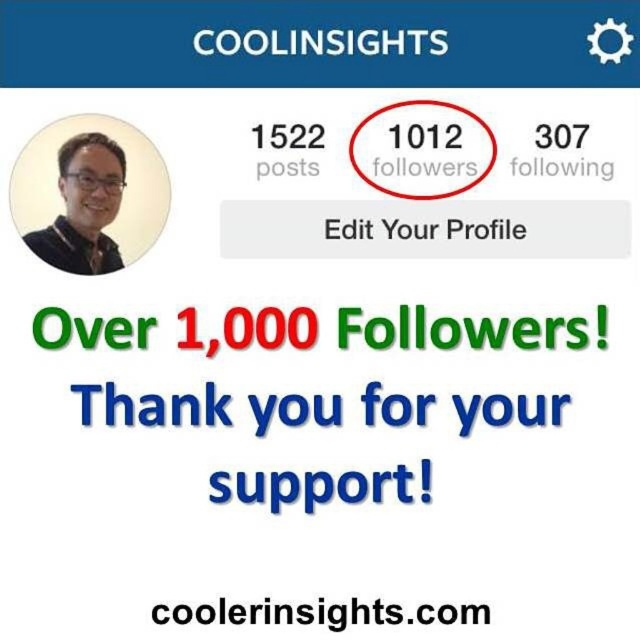
Does matte black glasses at upper left have a lesser height compared to black text at center?

Incorrect, matte black glasses at upper left's height does not fall short of black text at center's.

Is matte black glasses at upper left further to the viewer compared to black text at center?

Yes.

Is point (118, 177) farther from viewer compared to point (305, 609)?

Yes, point (118, 177) is behind point (305, 609).

Locate an element on the screen. The height and width of the screenshot is (640, 640). matte black glasses at upper left is located at coordinates (84, 208).